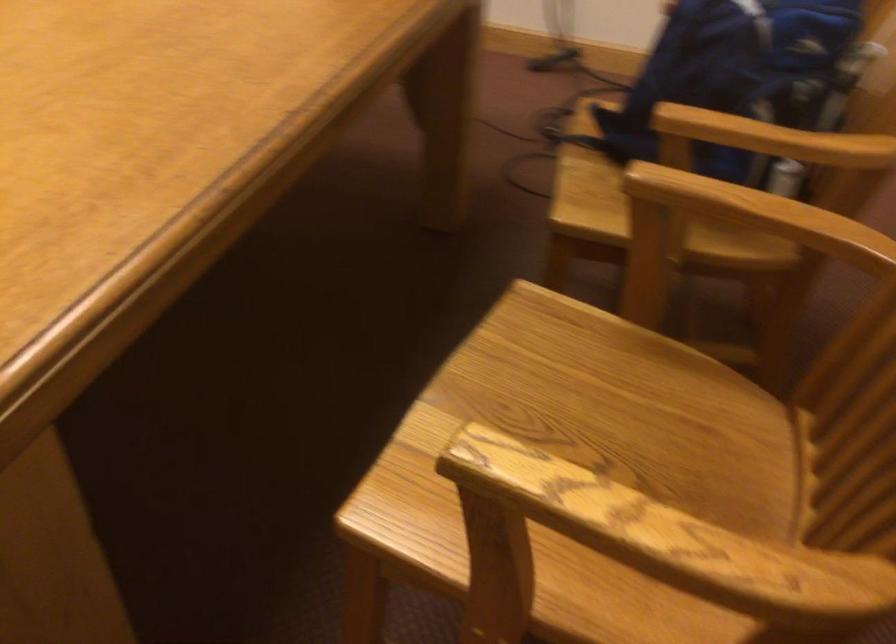
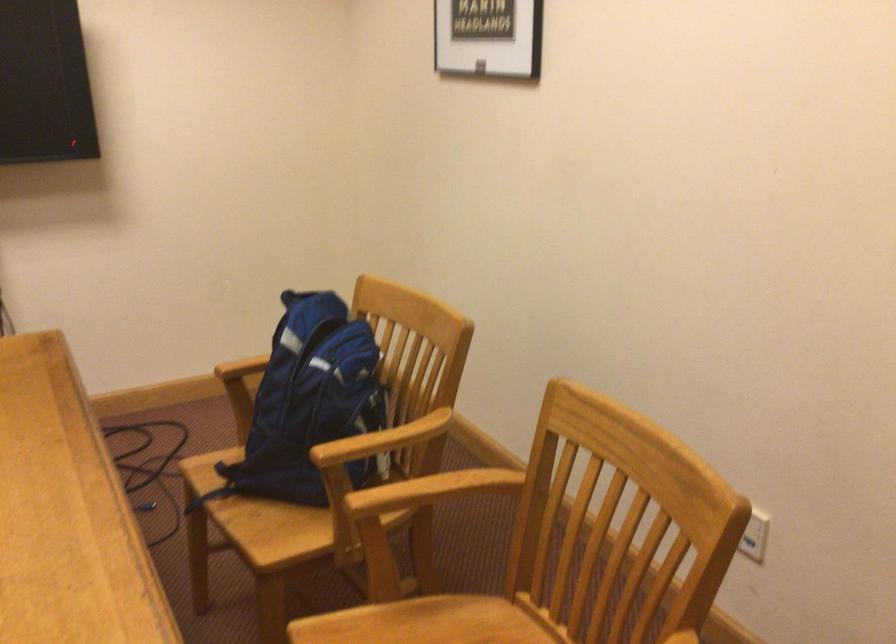
The point at (641,366) is marked in the first image. Where is the corresponding point in the second image?

(415, 627)